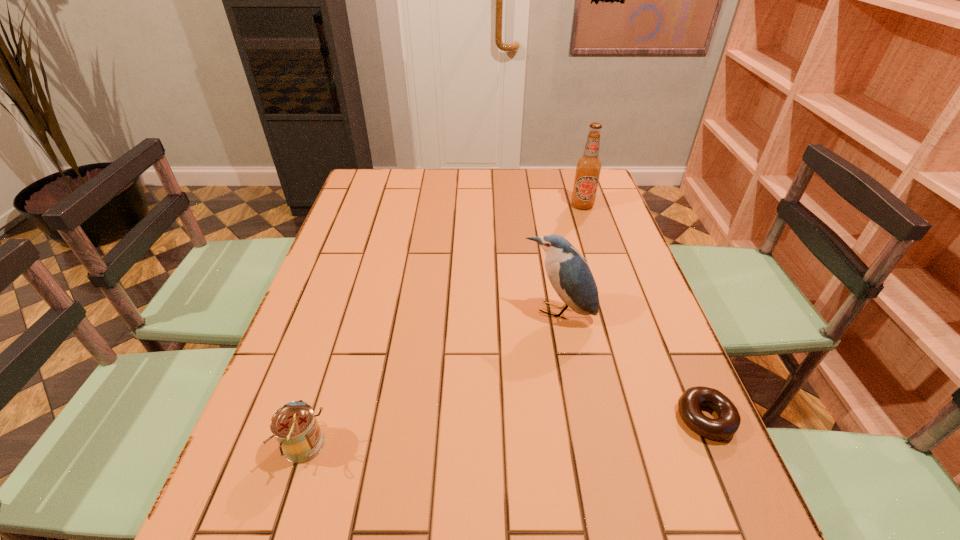
You are a GUI agent. You are given a task and a screenshot of the screen. Output one action in this format:
    pyautogui.click(x=<x>, y=<y>)
    Task: Click on the beer bottle that is at the right edge
    This screenshot has height=540, width=960.
    Given the screenshot: What is the action you would take?
    pyautogui.click(x=588, y=167)

Locate an element on the screen. This screenshot has height=540, width=960. bird that is at the right edge is located at coordinates (569, 274).

The width and height of the screenshot is (960, 540). Find the location of `object located at the near left corner`. object located at the near left corner is located at coordinates (294, 425).

Image resolution: width=960 pixels, height=540 pixels. What are the coordinates of `object positioned at the far right corner` in the screenshot? It's located at (588, 167).

This screenshot has width=960, height=540. Find the location of `vacant space at the far edge of the desktop`. vacant space at the far edge of the desktop is located at coordinates (554, 197).

In the image, there is a desktop. Find the location of `vacant space at the near edge`. vacant space at the near edge is located at coordinates (365, 454).

This screenshot has height=540, width=960. In the image, there is a desktop. Identify the location of vacant area at the left edge. (359, 235).

At what (x,y) coordinates should I click in order to perform the action: click on vacant space at the right edge of the desktop. Please return your answer as a coordinate pair (x, y). Looking at the image, I should click on (644, 424).

Find the location of `vacant region at the far left corner`. vacant region at the far left corner is located at coordinates (354, 198).

In the image, there is a desktop. Where is `vacant space at the far right corner`? The width and height of the screenshot is (960, 540). vacant space at the far right corner is located at coordinates (576, 172).